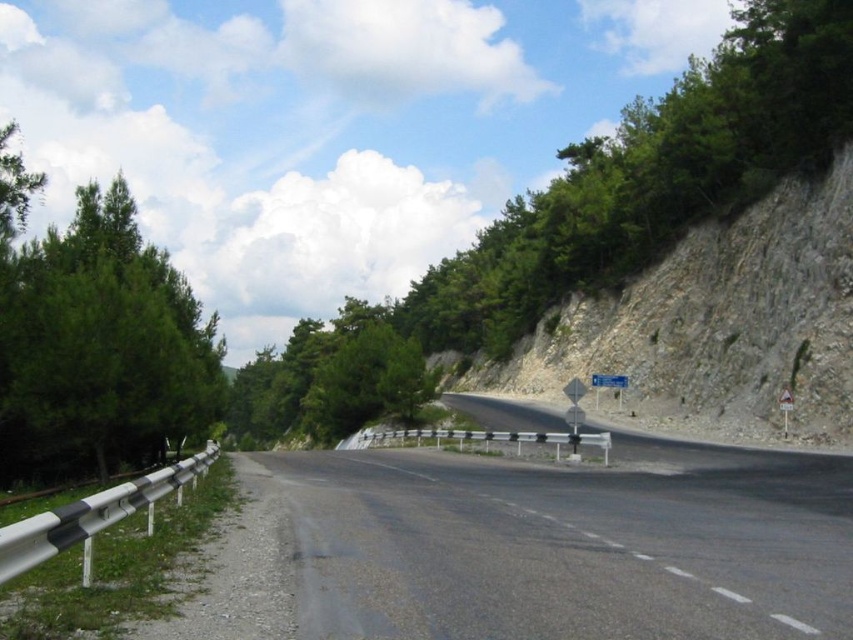
Question: Where is green leafy tree at upper center located in relation to blue plastic sign at center in the image?

Choices:
 (A) left
 (B) right

Answer: (B)

Question: Among these objects, which one is nearest to the camera?

Choices:
 (A) rocky gray hillside at right
 (B) green needle-like tree at left

Answer: (B)

Question: Can you confirm if green leafy tree at upper center is positioned above blue plastic sign at center?

Choices:
 (A) yes
 (B) no

Answer: (A)

Question: Which of the following is the closest to the observer?

Choices:
 (A) (596, 380)
 (B) (521, 195)

Answer: (A)

Question: Can you confirm if rocky gray hillside at right is positioned to the left of blue plastic sign at center?

Choices:
 (A) yes
 (B) no

Answer: (B)

Question: Which point is closer to the camera taking this photo?

Choices:
 (A) (91, 246)
 (B) (817, 76)
 (C) (671, 392)

Answer: (A)